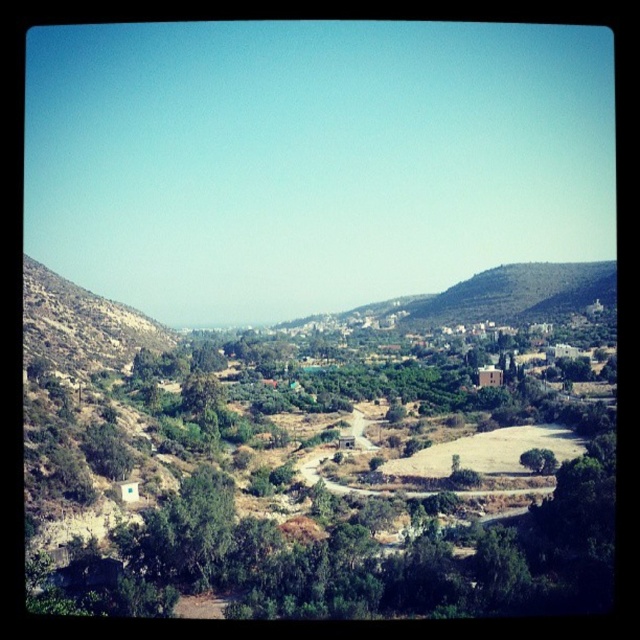
You are standing at the valley and see two points marked in the image. Which point, point (260, 528) or point (476, 298), is closer to you?

Point (260, 528) is closer to the viewer than point (476, 298).

You are standing at the valley bottom and want to take a photo of the green leafy tree at center and the green grassy hillside at upper right. Which object will appear larger in the photo?

The green leafy tree at center will appear larger in the photo because it is closer to you than the green grassy hillside at upper right.